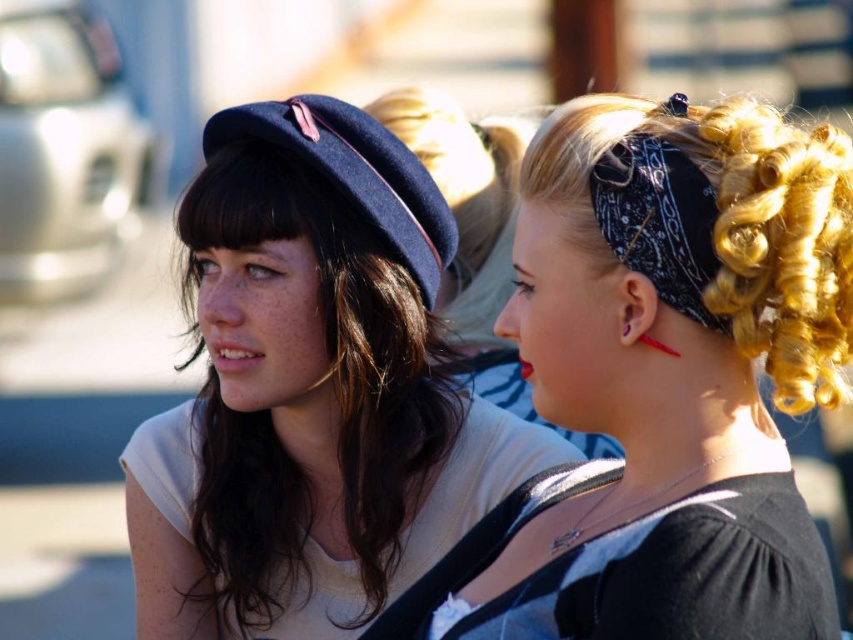
You are a photographer adjusting the lighting for a portrait. You notice the black bandana at right and the dark brown silky hair at center. Which object would require a narrower light beam to highlight its details due to its size?

The black bandana at right is thinner than the dark brown silky hair at center, so it would require a narrower light beam to highlight its details due to its smaller size.

You are a photographer adjusting your camera settings. You notice a black bandana at right and a navy blue beret with a pink ribbon detail at left. Which object is positioned closer to the point marked at coordinates (x=674, y=368)?

The black bandana at right is located at point (x=674, y=368), so it is exactly at that coordinate.